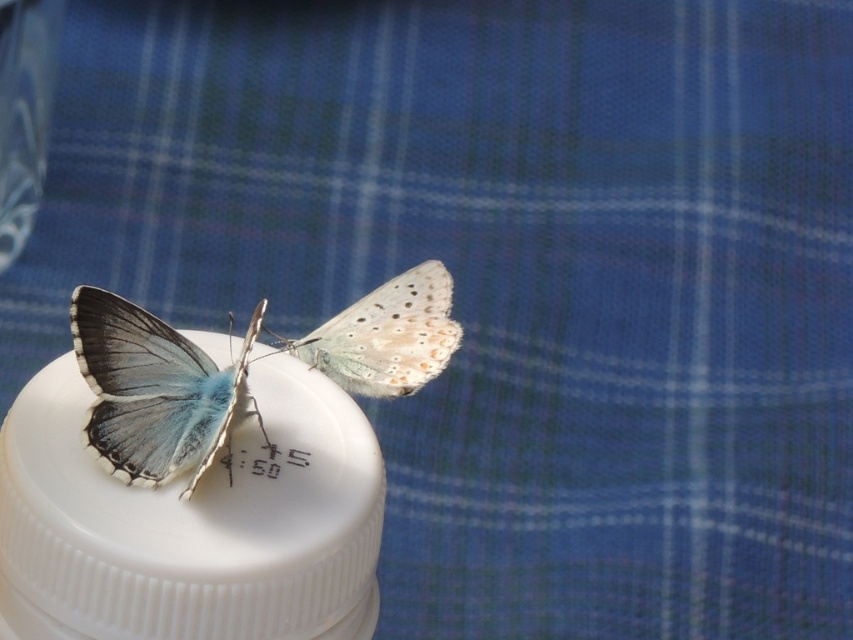
Question: Which object is closer to the camera taking this photo?

Choices:
 (A) translucent white butterfly at center
 (B) matte blue butterfly at center

Answer: (B)

Question: Which of the following is the farthest from the observer?

Choices:
 (A) (241, 346)
 (B) (325, 324)

Answer: (B)

Question: Considering the relative positions of matte blue butterfly at center and translucent white butterfly at center in the image provided, where is matte blue butterfly at center located with respect to translucent white butterfly at center?

Choices:
 (A) below
 (B) above

Answer: (A)

Question: Is the position of matte blue butterfly at center less distant than that of translucent white butterfly at center?

Choices:
 (A) yes
 (B) no

Answer: (A)

Question: Is matte blue butterfly at center above translucent white butterfly at center?

Choices:
 (A) yes
 (B) no

Answer: (B)

Question: Among these points, which one is farthest from the camera?

Choices:
 (A) (363, 394)
 (B) (112, 417)

Answer: (A)